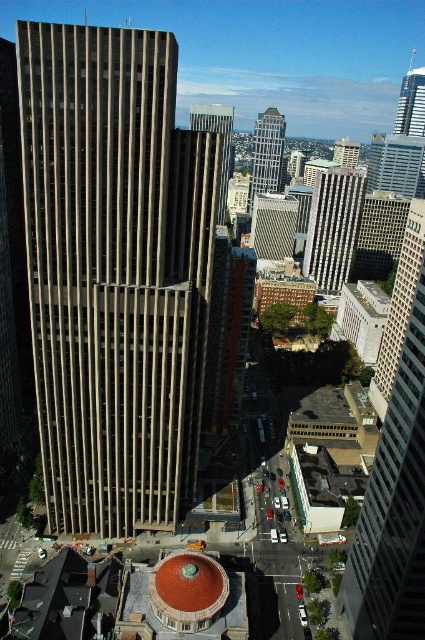
Question: Is brown textured building at center above smooth concrete skyscraper at center?

Choices:
 (A) yes
 (B) no

Answer: (B)

Question: Can you confirm if brown textured building at center is wider than smooth concrete skyscraper at center?

Choices:
 (A) yes
 (B) no

Answer: (B)

Question: Which point is farther from the camera taking this photo?

Choices:
 (A) (328, 250)
 (B) (203, 116)
 (C) (255, 172)
 (D) (263, 250)

Answer: (C)

Question: Can you confirm if brown textured building at center is positioned below glassy silver skyscraper at center?

Choices:
 (A) yes
 (B) no

Answer: (A)

Question: Which point is closer to the camera taking this photo?

Choices:
 (A) (193, 124)
 (B) (268, 189)
 (C) (325, 179)
 (D) (172, 56)

Answer: (D)

Question: Which of the following is the closest to the observer?

Choices:
 (A) glassy silver skyscraper at center
 (B) brown textured building at center
 (C) smooth concrete skyscraper at center
 (D) beige concrete skyscraper at center

Answer: (D)